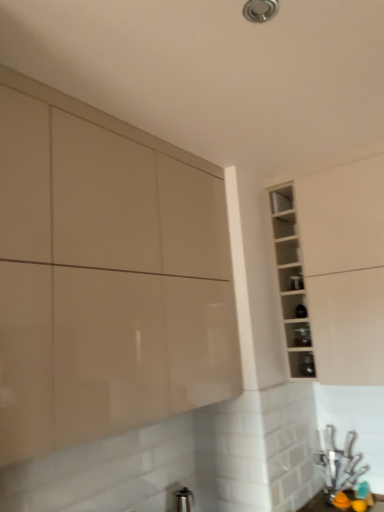
Question: In terms of height, does white glossy cabinet at upper right, the 1th cabinetry in the right-to-left sequence, look taller or shorter compared to transparent glass shelf at upper right, which appears as the first shelf when viewed from the top?

Choices:
 (A) tall
 (B) short

Answer: (A)

Question: From a real-world perspective, is white glossy cabinet at upper right, which appears as the 2th cabinetry when viewed from the left, physically located above or below transparent glass shelf at upper right, which appears as the first shelf when viewed from the top?

Choices:
 (A) above
 (B) below

Answer: (B)

Question: Which object is positioned farthest from the matte black shelf at center-right, placed as the second shelf when sorted from top to bottom?

Choices:
 (A) clear glass shelf at upper right, arranged as the third shelf when viewed from the top
 (B) glossy beige cabinet at upper left, placed as the 2th cabinetry when sorted from right to left
 (C) transparent glass shelf at upper right, which appears as the first shelf when viewed from the top
 (D) white glossy cabinet at upper right, the 1th cabinetry in the right-to-left sequence
 (E) white glossy cabinet at upper right

Answer: (B)

Question: Considering the real-world distances, which object is farthest from the transparent glass shelf at upper right, which appears as the 3th shelf when ordered from the bottom?

Choices:
 (A) white glossy cabinet at upper right, which appears as the 2th cabinetry when viewed from the left
 (B) white glossy cabinet at upper right
 (C) matte black shelf at center-right, the 2th shelf in the bottom-to-top sequence
 (D) clear glass shelf at upper right, marked as the first shelf in a bottom-to-top arrangement
 (E) glossy beige cabinet at upper left, arranged as the 1th cabinetry when viewed from the left

Answer: (E)